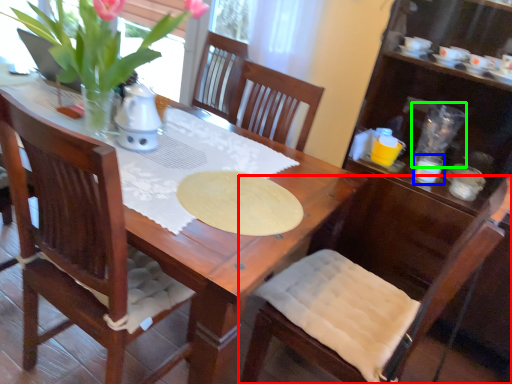
Question: Which object is the closest to the chair (highlighted by a red box)? Choose among these: tableware (highlighted by a blue box) or tableware (highlighted by a green box).

Choices:
 (A) tableware
 (B) tableware

Answer: (A)